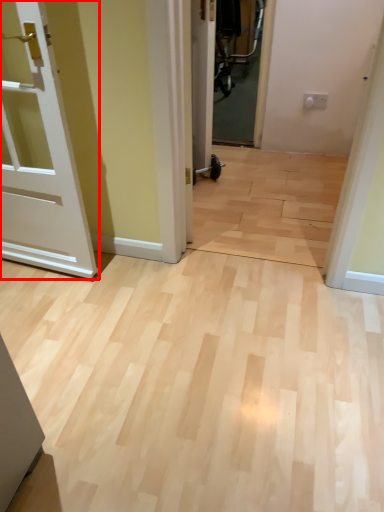
Question: From the image's perspective, where is door (annotated by the red box) located in relation to door in the image?

Choices:
 (A) above
 (B) below

Answer: (B)